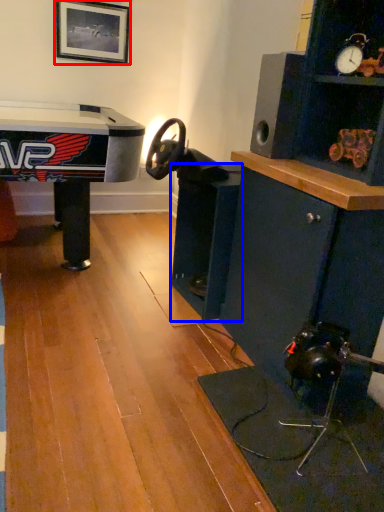
Question: Which of the following is the closest to the observer, picture frame (highlighted by a red box) or shelf (highlighted by a blue box)?

Choices:
 (A) picture frame
 (B) shelf

Answer: (B)